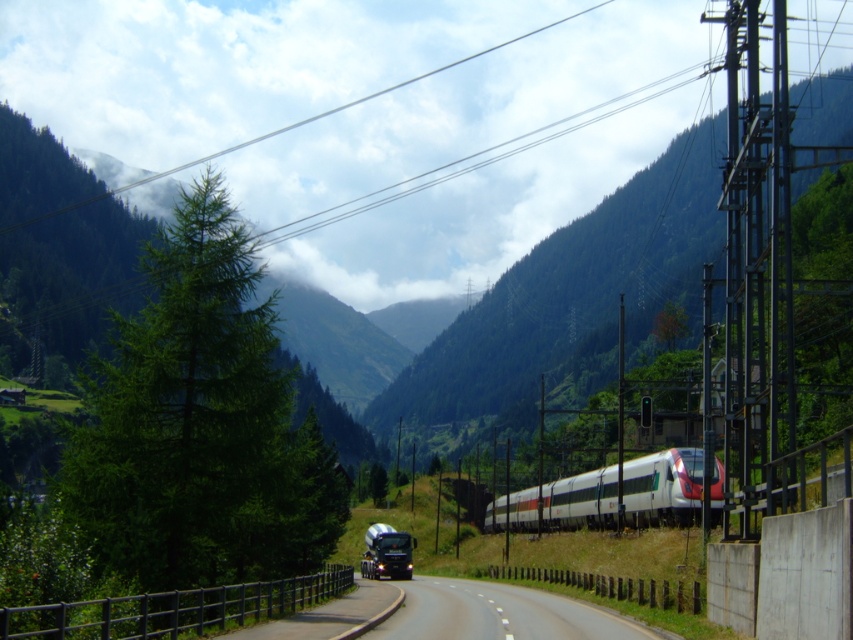
You are a drone operator trying to capture a photo of the asphalt road at center. The drone is currently at point (500, 614). Is the drone positioned directly above the asphalt road at center?

Yes, the asphalt road at center is located at point (500, 614), so the drone is positioned directly above the asphalt road at center.